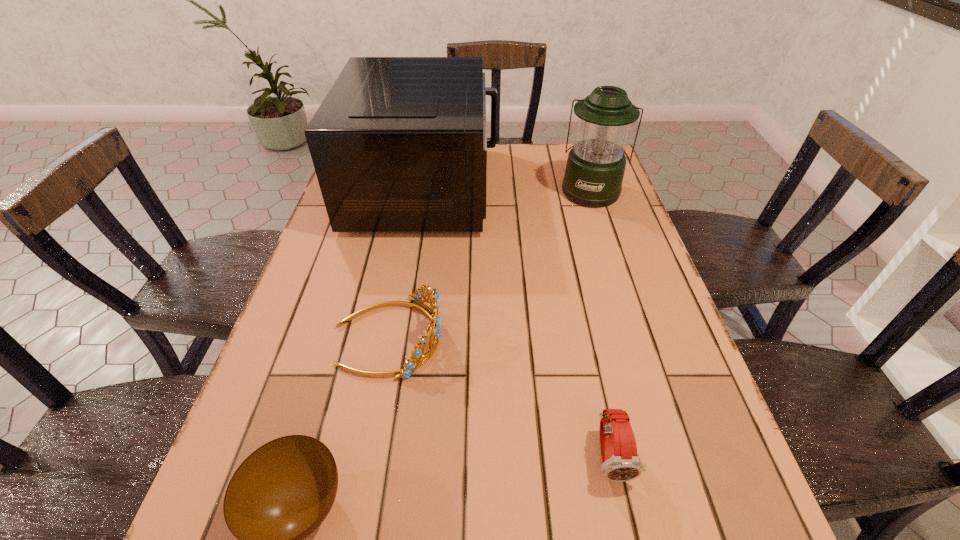
Locate an element on the screen. free space between the watch and the microwave_oven is located at coordinates (518, 322).

Locate an element on the screen. free space between the lantern and the watch is located at coordinates (601, 323).

Locate an element on the screen. empty space between the third nearest object and the lantern is located at coordinates (490, 264).

The image size is (960, 540). Find the location of `free space between the tiara and the lantern`. free space between the tiara and the lantern is located at coordinates [x=490, y=264].

Where is `vacant point located between the lantern and the watch`? Image resolution: width=960 pixels, height=540 pixels. vacant point located between the lantern and the watch is located at coordinates (601, 323).

Locate an element on the screen. This screenshot has width=960, height=540. free space between the third nearest object and the lantern is located at coordinates (490, 264).

Locate an element on the screen. free space between the watch and the third shortest object is located at coordinates point(500,396).

The height and width of the screenshot is (540, 960). I want to click on vacant space that is in between the tiara and the microwave_oven, so click(x=407, y=262).

Locate which object is the third closest to the shortest object. Please provide its 2D coordinates. Your answer should be formatted as a tuple, i.e. [(x, y)], where the tuple contains the x and y coordinates of a point satisfying the conditions above.

[(399, 144)]

You are a GUI agent. You are given a task and a screenshot of the screen. Output one action in this format:
    pyautogui.click(x=<x>, y=<y>)
    Task: Click on the object that stands as the second closest to the tiara
    
    Given the screenshot: What is the action you would take?
    pyautogui.click(x=399, y=144)